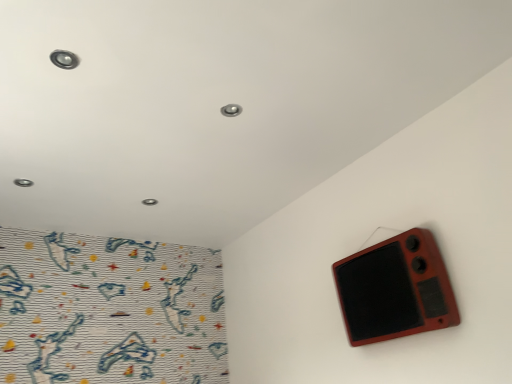
What do you see at coordinates (395, 289) in the screenshot? I see `matte red speaker at upper right` at bounding box center [395, 289].

The image size is (512, 384). In order to click on matte red speaker at upper right in this screenshot , I will do `click(395, 289)`.

Where is `matte red speaker at upper right`? This screenshot has width=512, height=384. matte red speaker at upper right is located at coordinates (395, 289).